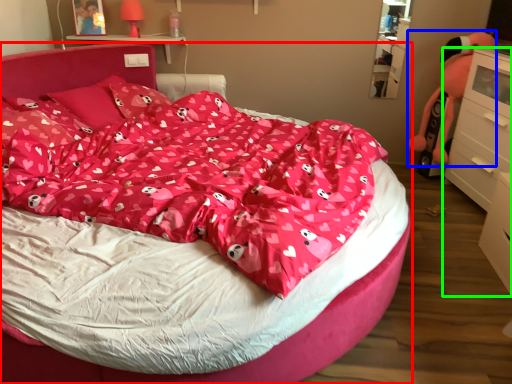
Question: Considering the real-world distances, which object is closest to bed (highlighted by a red box)? toy (highlighted by a blue box) or chest of drawers (highlighted by a green box).

Choices:
 (A) toy
 (B) chest of drawers

Answer: (B)